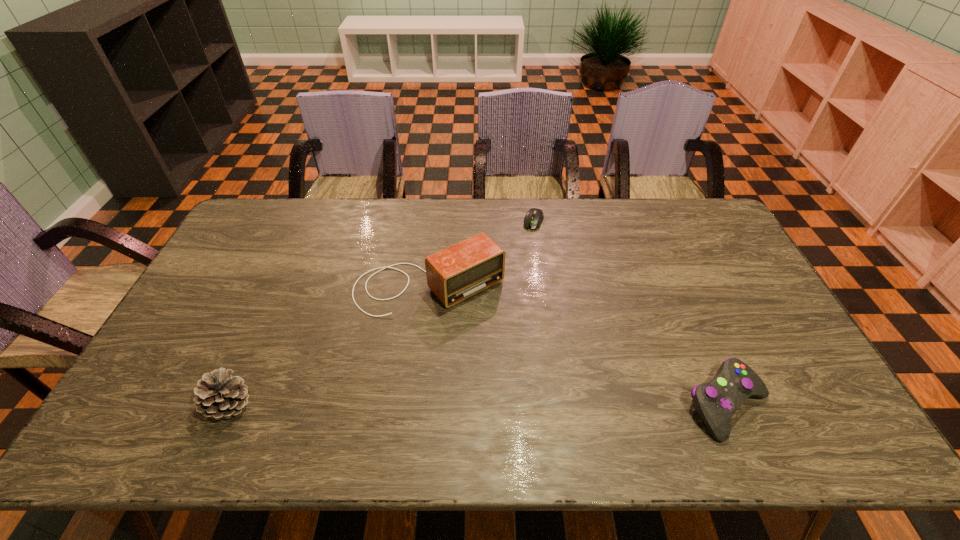
Identify the location of vacant spot on the desktop that is between the leftmost object and the third tallest object and is positioned on the front-facing side of the second object from left to right. (527, 405).

Locate an element on the screen. The image size is (960, 540). vacant spot on the desktop that is between the pinecone and the second shortest object and is positioned on the wheel side of the shortest object is located at coordinates (453, 405).